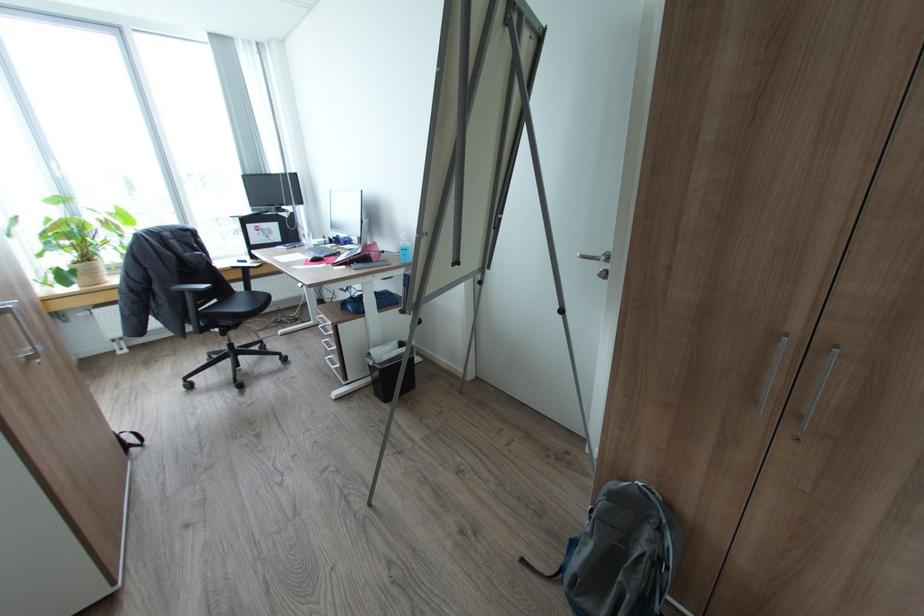
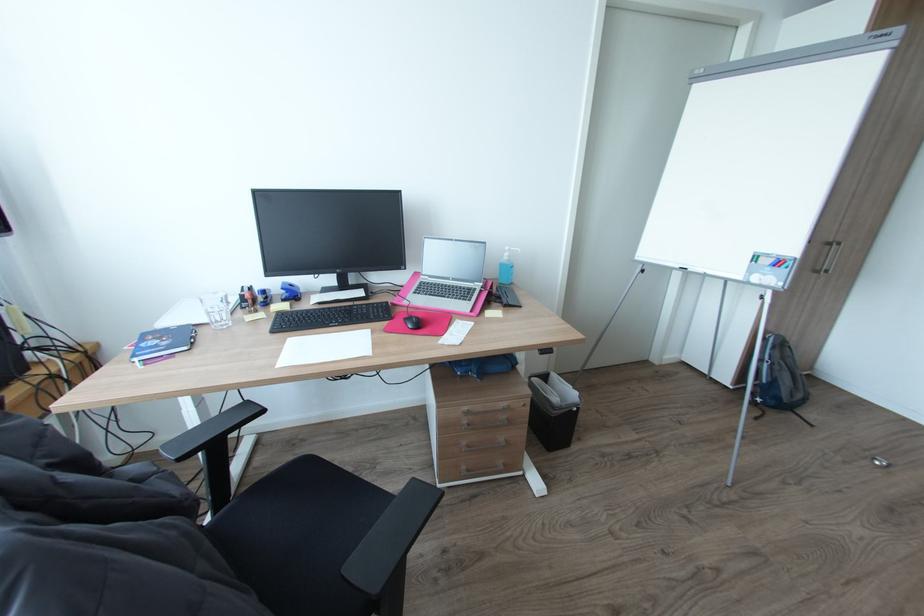
The point at (314,259) is marked in the first image. Where is the corresponding point in the second image?

(417, 326)